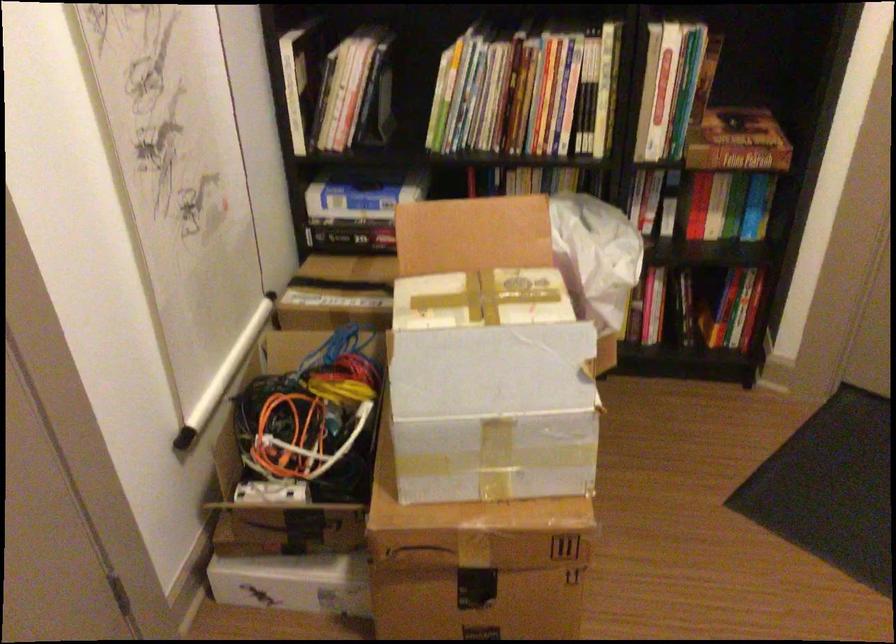
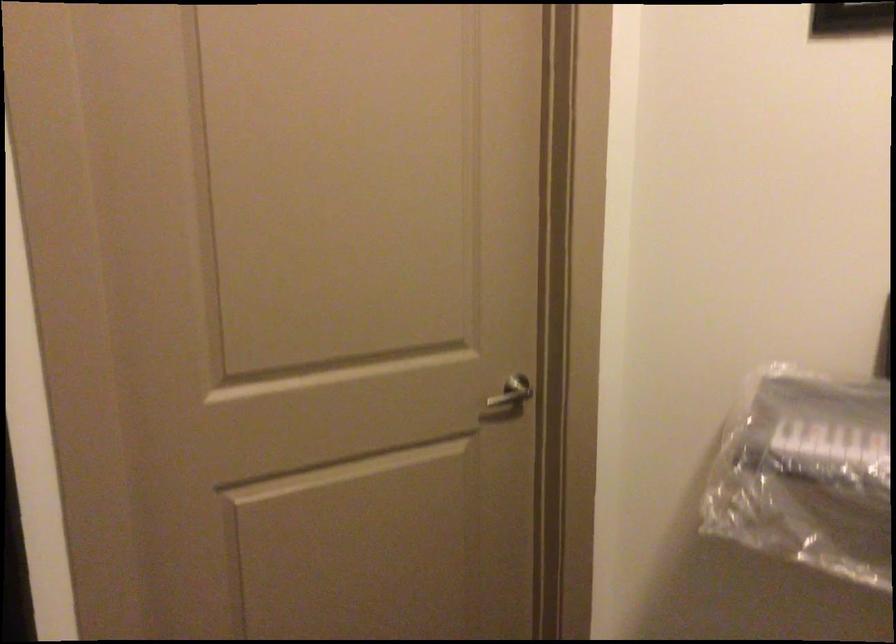
Question: The images are taken continuously from a first-person perspective. In which direction is your viewpoint rotating?

Choices:
 (A) Left
 (B) Right
 (C) Up
 (D) Down

Answer: (B)